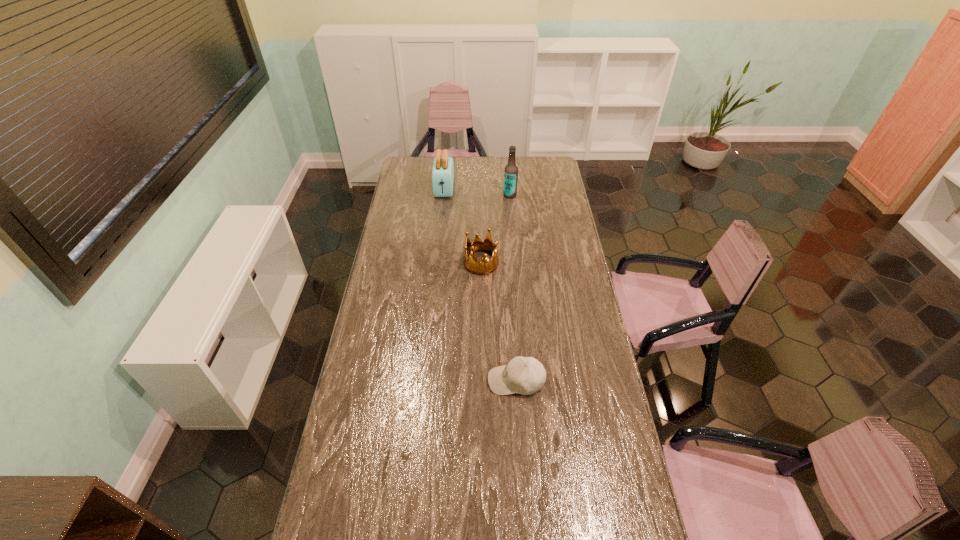
Locate an element on the screen. the closest object to the shortest object is located at coordinates (471, 264).

Image resolution: width=960 pixels, height=540 pixels. Find the location of `object identified as the third closest to the leftmost object`. object identified as the third closest to the leftmost object is located at coordinates click(524, 375).

Identify the location of free space in the image that satisfies the following two spatial constraints: 1. on the side of the leftmost object with the lever; 2. on the left side of the crown. This screenshot has width=960, height=540. (437, 263).

Locate an element on the screen. Image resolution: width=960 pixels, height=540 pixels. free space in the image that satisfies the following two spatial constraints: 1. on the side of the leftmost object with the lever; 2. on the left side of the second nearest object is located at coordinates (437, 263).

Find the location of `vacant area that satisfies the following two spatial constraints: 1. on the side of the beer bottle with the label; 2. on the front side of the third tallest object`. vacant area that satisfies the following two spatial constraints: 1. on the side of the beer bottle with the label; 2. on the front side of the third tallest object is located at coordinates (516, 263).